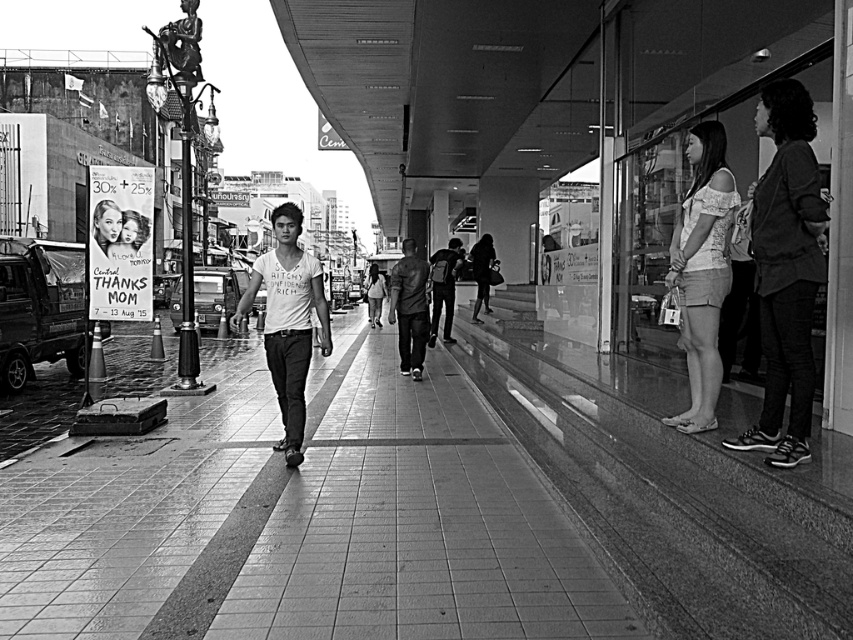
Question: Which of the following is the closest to the observer?

Choices:
 (A) (705, 330)
 (B) (418, 378)
 (C) (296, 269)
 (D) (363, 582)

Answer: (D)

Question: Is dark gray sweater at right below white lace top at right?

Choices:
 (A) yes
 (B) no

Answer: (B)

Question: Does glassy reflective shop window at right have a greater width compared to dark gray sweater at right?

Choices:
 (A) no
 (B) yes

Answer: (B)

Question: Which point is farther from the camera taking this photo?

Choices:
 (A) (495, 259)
 (B) (53, 579)
 (C) (422, 310)
 (D) (453, 276)

Answer: (A)

Question: Considering the real-world distances, which object is closest to the white lace top at right?

Choices:
 (A) dark gray backpack at center
 (B) glassy reflective shop window at right

Answer: (B)

Question: Where is smooth concrete pavement at center located in relation to matte black bag at center in the image?

Choices:
 (A) below
 (B) above

Answer: (A)